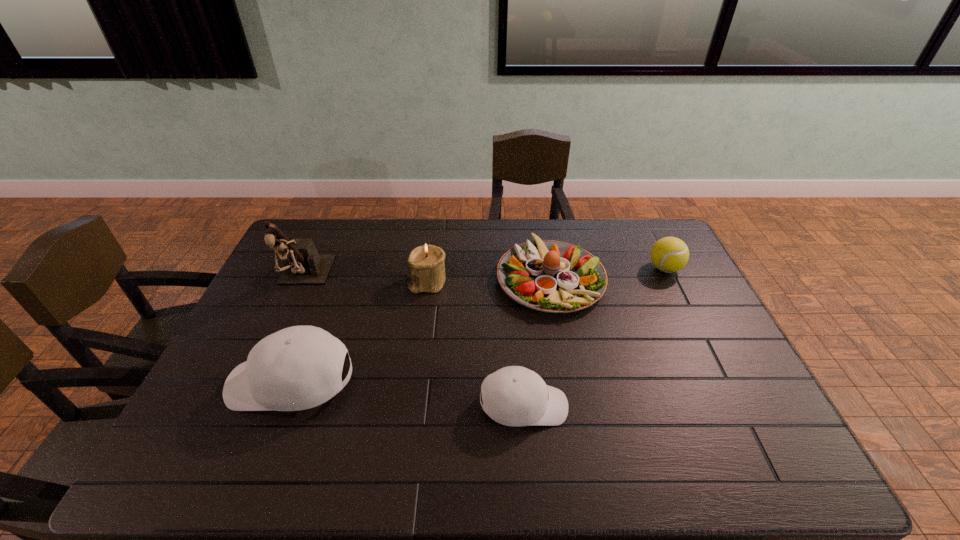
This screenshot has width=960, height=540. Identify the location of the second closest object relative to the rightmost object. (516, 396).

The height and width of the screenshot is (540, 960). Find the location of `free location that satisfies the following two spatial constraints: 1. on the back side of the salad plate; 2. on the left side of the tennis ball`. free location that satisfies the following two spatial constraints: 1. on the back side of the salad plate; 2. on the left side of the tennis ball is located at coordinates (548, 268).

Where is `free space that satisfies the following two spatial constraints: 1. on the front-facing side of the candle_holder; 2. on the left side of the tallest object`? free space that satisfies the following two spatial constraints: 1. on the front-facing side of the candle_holder; 2. on the left side of the tallest object is located at coordinates (302, 282).

Locate an element on the screen. vacant position in the image that satisfies the following two spatial constraints: 1. on the front side of the salad plate; 2. on the front-facing side of the left baseball cap is located at coordinates (569, 383).